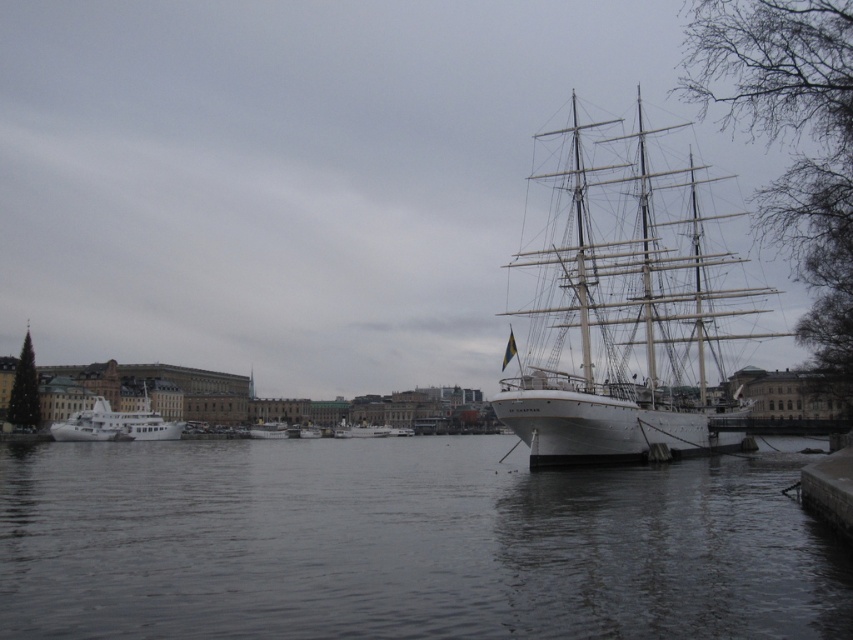
Question: Which of the following is the farthest from the observer?

Choices:
 (A) (x=793, y=576)
 (B) (x=582, y=362)

Answer: (B)

Question: Which point is closer to the camera?

Choices:
 (A) white glossy boat at center
 (B) white glossy yacht at left
 (C) dark gray water at center
 (D) white wooden boat at center

Answer: (C)

Question: Observing the image, what is the correct spatial positioning of dark gray water at center in reference to white wooden sailboat at right?

Choices:
 (A) right
 (B) left

Answer: (B)

Question: Which of the following is the farthest from the observer?

Choices:
 (A) white wooden boat at center
 (B) white wooden sailboat at right
 (C) white glossy boat at center
 (D) white glossy yacht at left

Answer: (C)

Question: Considering the relative positions of white wooden sailboat at right and white glossy boat at center in the image provided, where is white wooden sailboat at right located with respect to white glossy boat at center?

Choices:
 (A) below
 (B) above

Answer: (B)

Question: Does dark gray water at center have a larger size compared to white glossy yacht at left?

Choices:
 (A) no
 (B) yes

Answer: (B)